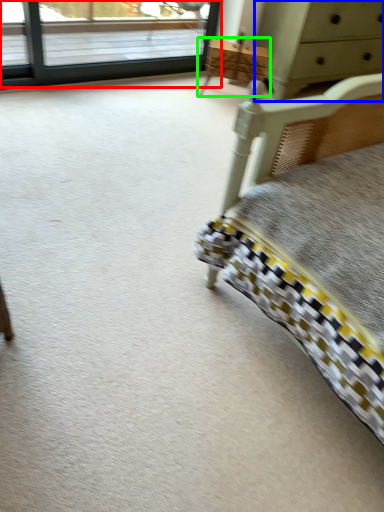
Question: Estimate the real-world distances between objects in this image. Which object is closer to window (highlighted by a red box), chest of drawers (highlighted by a blue box) or furniture (highlighted by a green box)?

Choices:
 (A) chest of drawers
 (B) furniture

Answer: (B)